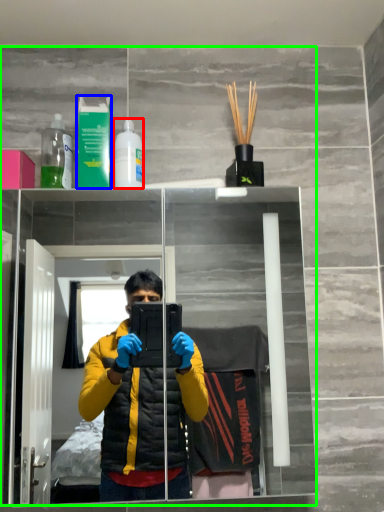
Question: Estimate the real-world distances between objects in this image. Which object is farther from bottle (highlighted by a red box), mouthwash (highlighted by a blue box) or mirror (highlighted by a green box)?

Choices:
 (A) mouthwash
 (B) mirror

Answer: (B)